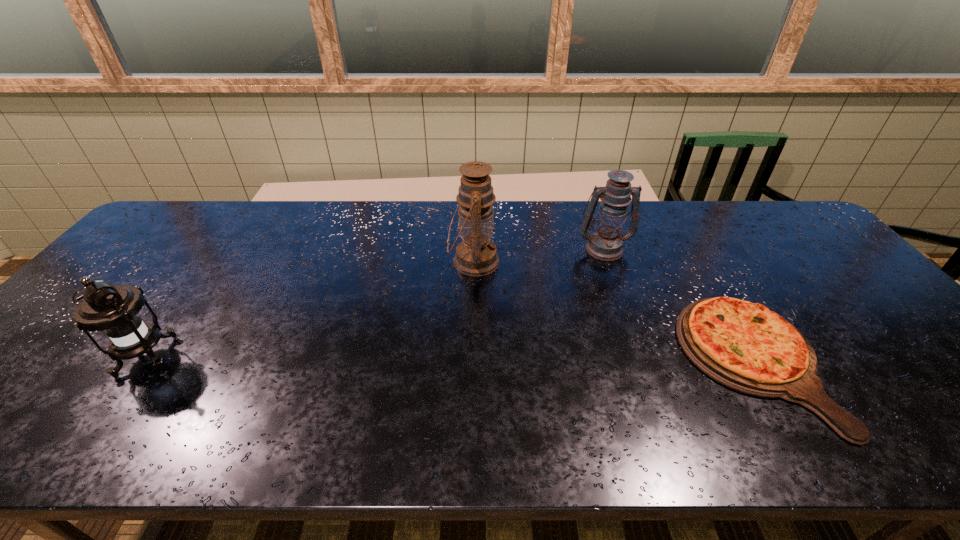
What are the coordinates of `object that is the closest to the farther lantern` in the screenshot? It's located at (744, 346).

Select which object is the second closest to the rightmost object. Please provide its 2D coordinates. Your answer should be formatted as a tuple, i.e. [(x, y)], where the tuple contains the x and y coordinates of a point satisfying the conditions above.

[(476, 255)]

Find the location of `blank space that satisfies the following two spatial constraints: 1. on the front-facing side of the farther lantern; 2. on the right side of the shortest object`. blank space that satisfies the following two spatial constraints: 1. on the front-facing side of the farther lantern; 2. on the right side of the shortest object is located at coordinates (643, 362).

The width and height of the screenshot is (960, 540). Identify the location of vacant space that satisfies the following two spatial constraints: 1. on the front-facing side of the third object from left to right; 2. on the left side of the shortest object. (643, 362).

What are the coordinates of `free space that satisfies the following two spatial constraints: 1. on the front-facing side of the right lantern; 2. on the right side of the shortest object` in the screenshot? It's located at (643, 362).

Find the location of `free region that satisfies the following two spatial constraints: 1. on the front-facing side of the rightmost object; 2. on the left side of the right lantern`. free region that satisfies the following two spatial constraints: 1. on the front-facing side of the rightmost object; 2. on the left side of the right lantern is located at coordinates (643, 362).